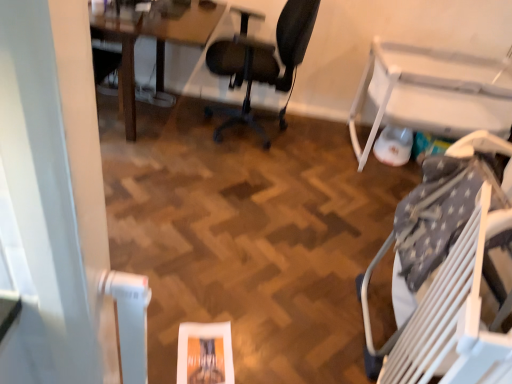
Locate an element on the screen. Image resolution: width=512 pixels, height=384 pixels. free point below wooden table at upper left, placed as the first table when sorted from left to right (from a real-world perspective) is located at coordinates (162, 110).